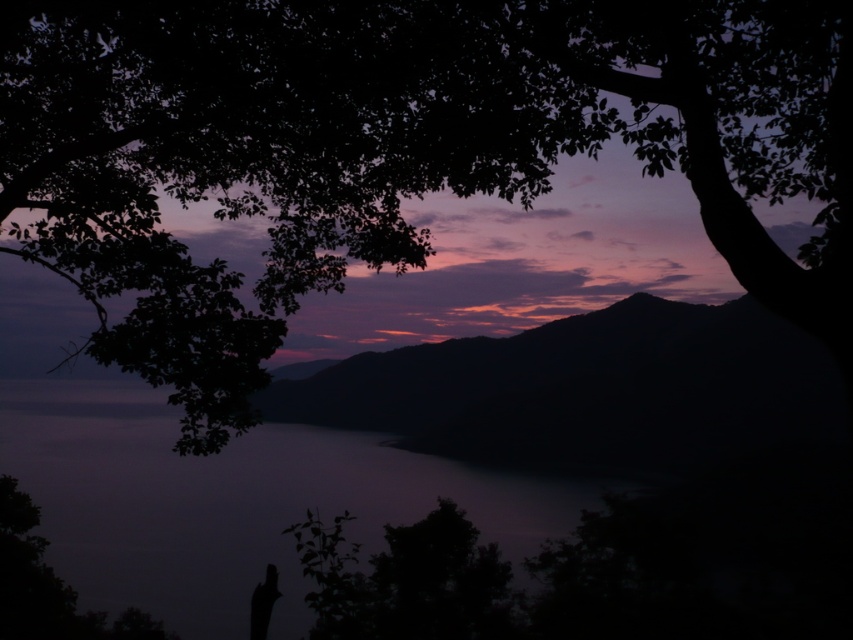
Question: Estimate the real-world distances between objects in this image. Which object is farther from the silhouette figure at lower left?

Choices:
 (A) smooth water at center
 (B) dark leafy tree at upper left

Answer: (B)

Question: Is dark leafy tree at upper left to the left of smooth water at center from the viewer's perspective?

Choices:
 (A) no
 (B) yes

Answer: (A)

Question: From the image, what is the correct spatial relationship of dark leafy tree at upper left in relation to silhouette figure at lower left?

Choices:
 (A) left
 (B) right

Answer: (B)

Question: Is dark leafy tree at upper left below smooth water at center?

Choices:
 (A) no
 (B) yes

Answer: (A)

Question: Which of the following is the farthest from the observer?

Choices:
 (A) (82, 408)
 (B) (633, 29)
 (C) (265, 611)

Answer: (A)

Question: Considering the real-world distances, which object is closest to the silhouette figure at lower left?

Choices:
 (A) smooth water at center
 (B) dark leafy tree at upper left

Answer: (A)